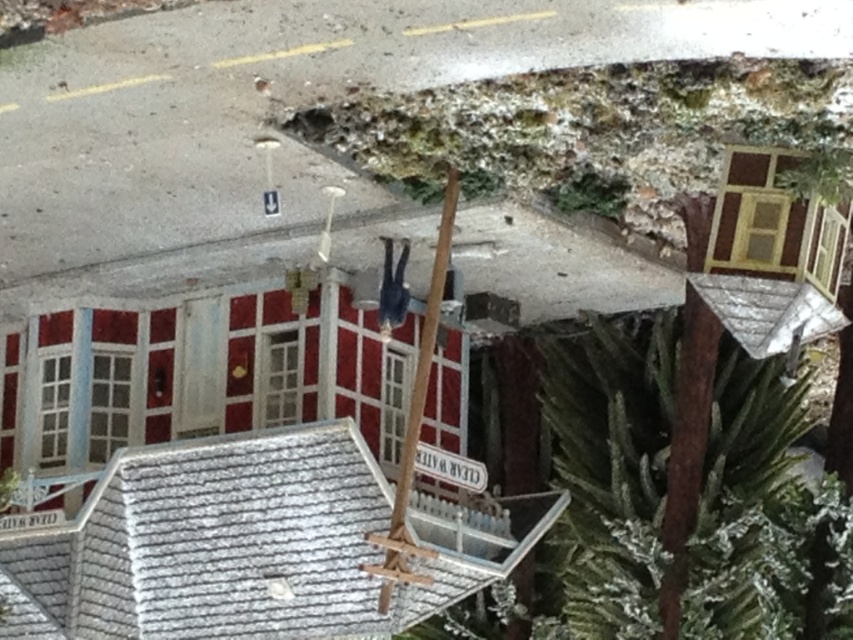
Between green mossy tree trunk at upper center and green textured pine tree at center right, which one is positioned lower?

Positioned lower is green textured pine tree at center right.

Is green mossy tree trunk at upper center smaller than green textured pine tree at center right?

Yes, green mossy tree trunk at upper center is smaller than green textured pine tree at center right.

Does point (445, 132) come behind point (660, 403)?

That is False.

Find the location of a particular element. This screenshot has height=640, width=853. green mossy tree trunk at upper center is located at coordinates (596, 131).